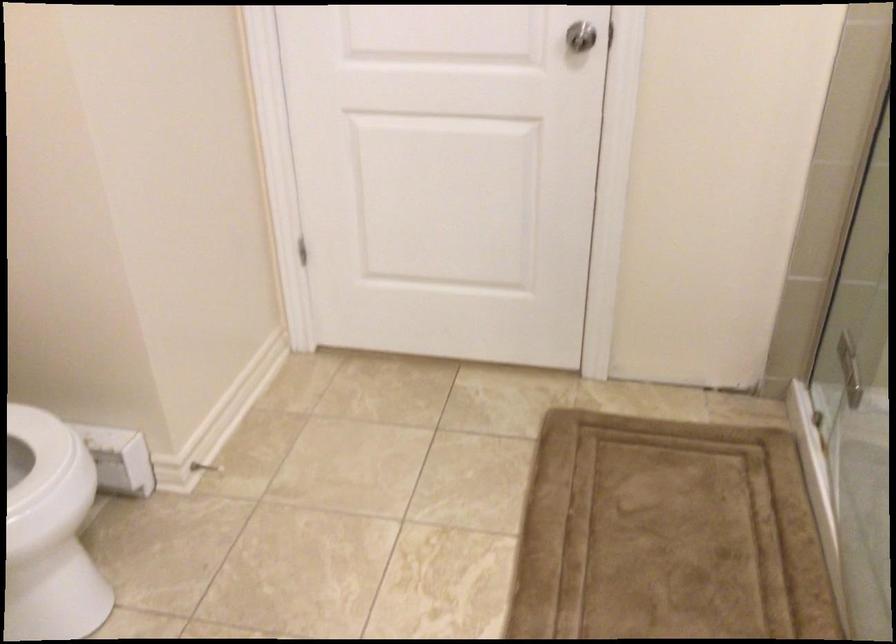
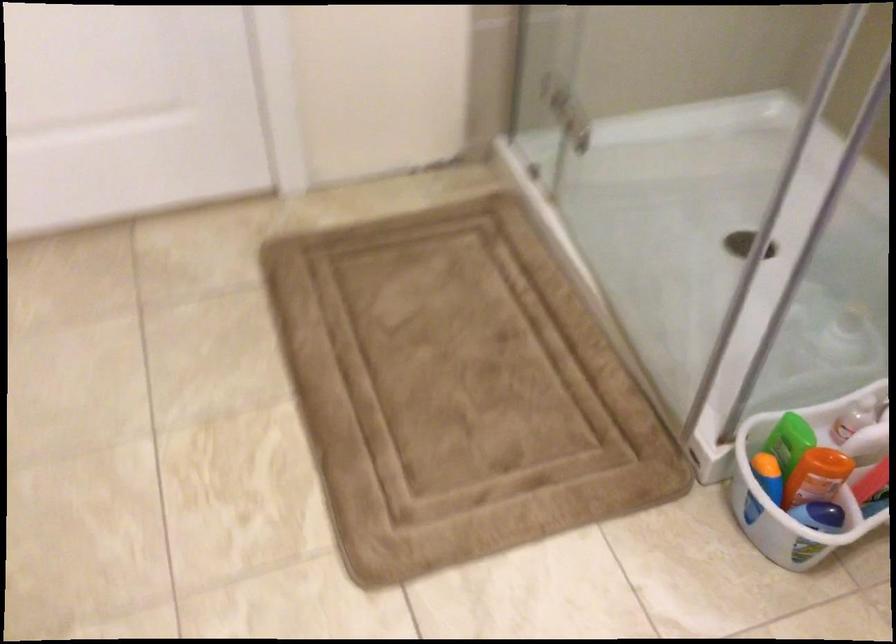
First-person continuous shooting, in which direction is the camera rotating?

The rotation direction of the camera is right-down.